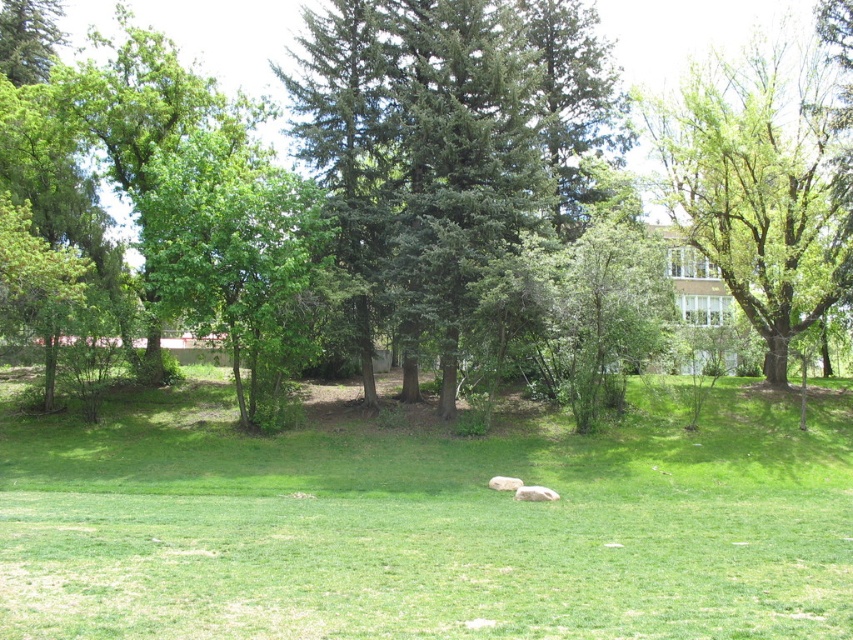
Question: Among these objects, which one is nearest to the camera?

Choices:
 (A) green leafy tree at center
 (B) green leafy tree at upper right

Answer: (B)

Question: Among these points, which one is nearest to the camera?

Choices:
 (A) (689, 168)
 (B) (809, 531)
 (C) (260, 40)

Answer: (B)

Question: Can you confirm if green grassy field at center is thinner than green leafy tree at center?

Choices:
 (A) yes
 (B) no

Answer: (A)

Question: Which point is farther from the camera taking this photo?

Choices:
 (A) (816, 179)
 (B) (730, 563)
 (C) (277, 93)

Answer: (C)

Question: Is green leafy tree at upper right behind green leafy tree at center?

Choices:
 (A) yes
 (B) no

Answer: (B)

Question: Does green grassy field at center appear under green leafy tree at center?

Choices:
 (A) no
 (B) yes

Answer: (B)